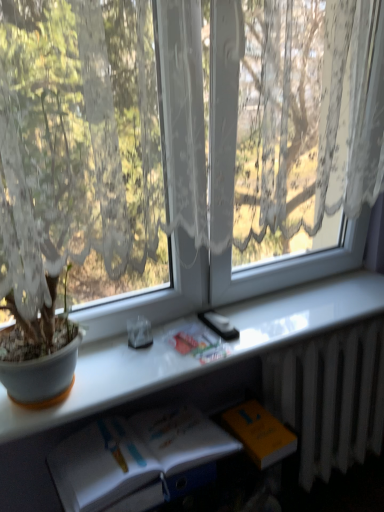
You are a GUI agent. You are given a task and a screenshot of the screen. Output one action in this format:
    pyautogui.click(x=<x>, y=<y>)
    Task: Click on the vacant area that is situated to the right of matte plastic book at center, arranged as the 1th book when viewed from the top
    This screenshot has width=384, height=512.
    Given the screenshot: What is the action you would take?
    tap(244, 332)